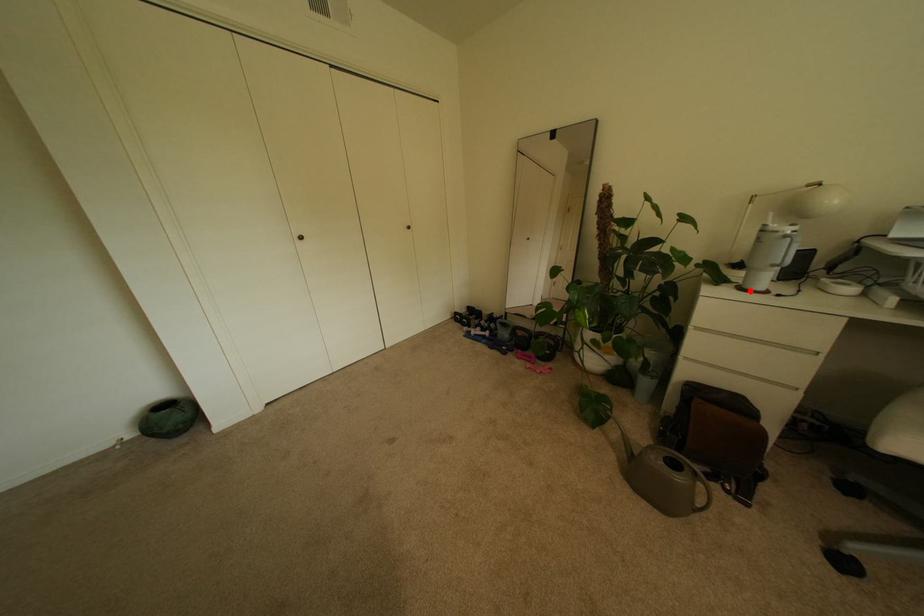
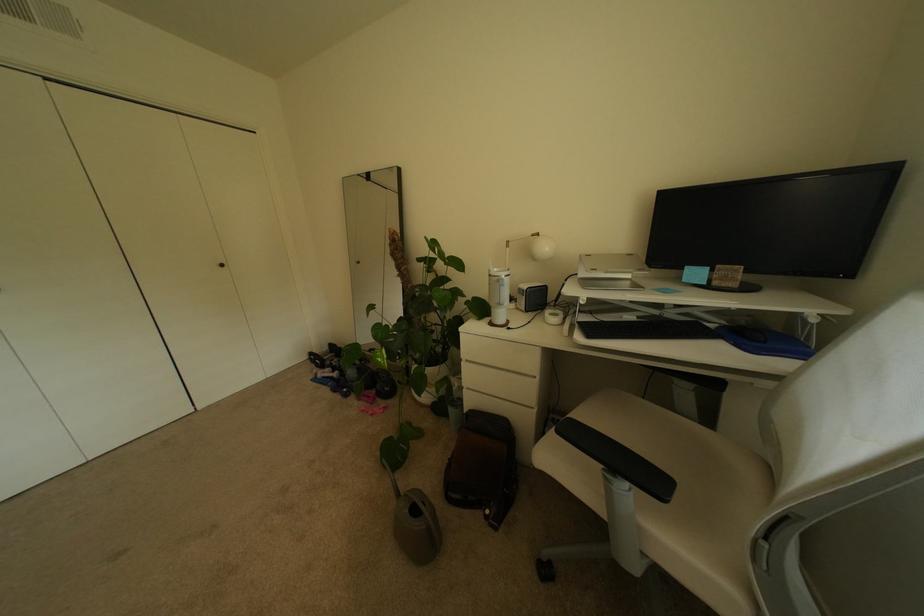
Find the pixel in the second image that matches the highlighted location in the first image.

(500, 325)